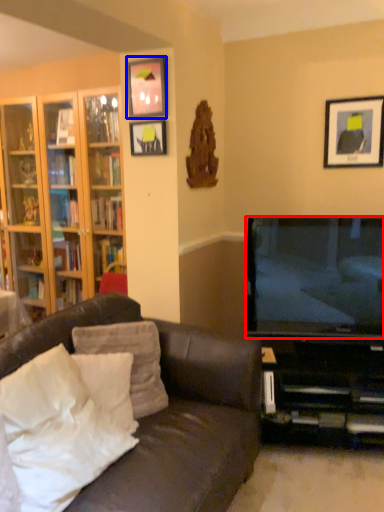
Question: Which point is further to the camera, television (highlighted by a red box) or picture frame (highlighted by a blue box)?

Choices:
 (A) television
 (B) picture frame

Answer: (B)